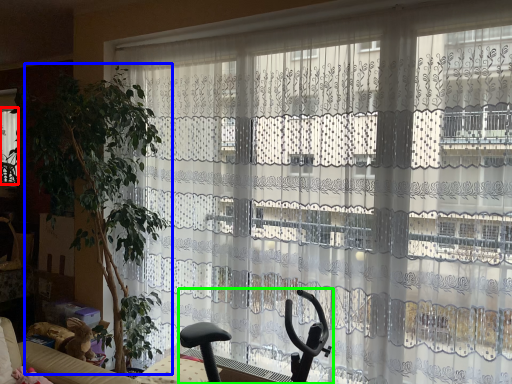
Question: Which object is positioned closest to window (highlighted by a red box)? Select from plant (highlighted by a blue box) and swivel chair (highlighted by a green box).

Choices:
 (A) plant
 (B) swivel chair

Answer: (A)